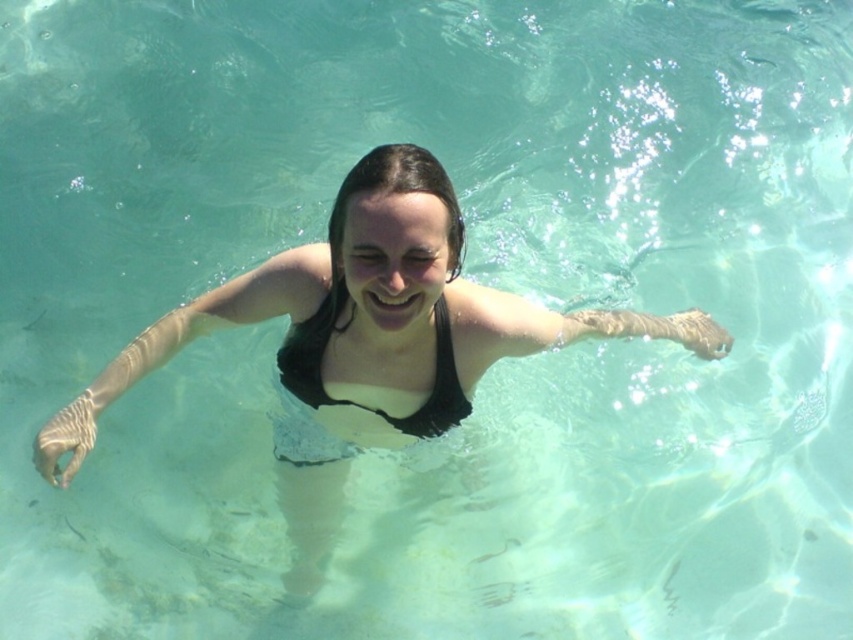
Question: Does black matte swimsuit at center appear under black matte bikini top at center?

Choices:
 (A) yes
 (B) no

Answer: (B)

Question: Among these objects, which one is farthest from the camera?

Choices:
 (A) black matte bikini top at center
 (B) black matte swimsuit at center

Answer: (A)

Question: Does black matte swimsuit at center come in front of black matte bikini top at center?

Choices:
 (A) no
 (B) yes

Answer: (B)

Question: Is black matte swimsuit at center below black matte bikini top at center?

Choices:
 (A) yes
 (B) no

Answer: (B)

Question: Which object is farther from the camera taking this photo?

Choices:
 (A) black matte swimsuit at center
 (B) black matte bikini top at center

Answer: (B)